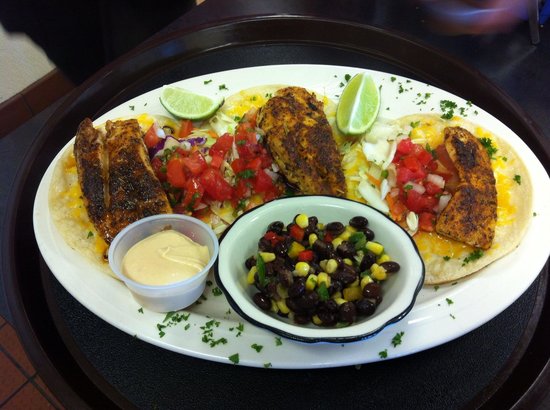
Identify the location of tile floor. The image size is (550, 410). (24, 381).